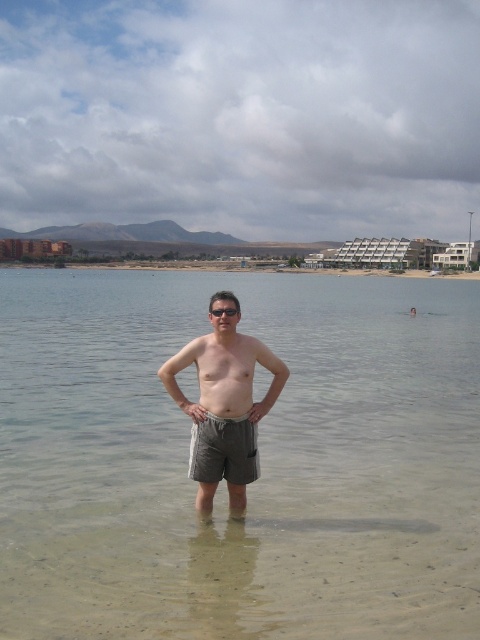
What do you see at coordinates (261, 461) in the screenshot? The width and height of the screenshot is (480, 640). I see `gray fabric shorts at center` at bounding box center [261, 461].

Can you confirm if gray fabric shorts at center is positioned to the right of gray cotton shorts at center?

In fact, gray fabric shorts at center is to the left of gray cotton shorts at center.

Which is behind, point (45, 534) or point (235, 435)?

Point (45, 534)

Identify the location of gray fabric shorts at center. [x=261, y=461].

Is gray cotton shorts at center below transparent plastic goggles at center?

Correct, gray cotton shorts at center is located below transparent plastic goggles at center.

Can you confirm if gray cotton shorts at center is bigger than transparent plastic goggles at center?

Yes.

Is point (244, 460) behind point (225, 314)?

That is True.

What are the coordinates of `gray cotton shorts at center` in the screenshot? It's located at (224, 451).

Can you confirm if gray fabric shorts at center is positioned to the left of transparent plastic goggles at center?

Yes, gray fabric shorts at center is to the left of transparent plastic goggles at center.

Can you confirm if gray fabric shorts at center is taller than transparent plastic goggles at center?

Indeed, gray fabric shorts at center has a greater height compared to transparent plastic goggles at center.

At what (x,y) coordinates should I click in order to perform the action: click on gray fabric shorts at center. Please return your answer as a coordinate pair (x, y). This screenshot has height=640, width=480. Looking at the image, I should click on (261, 461).